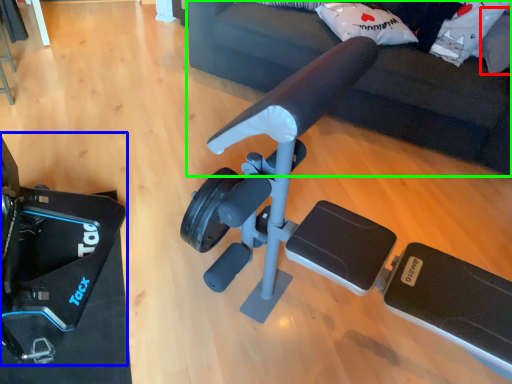
Question: Considering the real-world distances, which object is closest to pillow (highlighted by a red box)? video camera (highlighted by a blue box) or furniture (highlighted by a green box).

Choices:
 (A) video camera
 (B) furniture

Answer: (B)